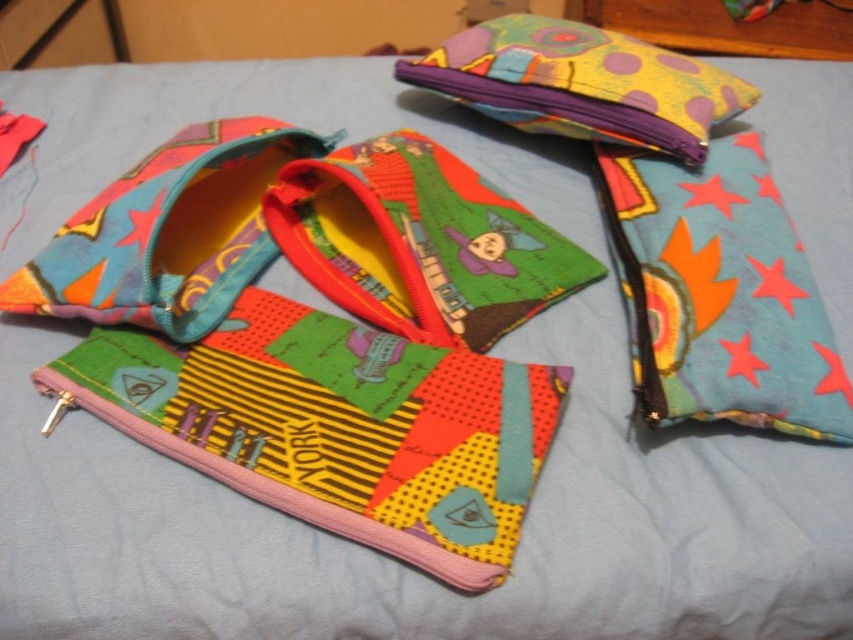
Is point (817, 348) positioned after point (502, 19)?

That is False.

Who is more distant from viewer, (670, 400) or (543, 44)?

The point (543, 44) is more distant.

Where is `teal fabric pouch at right`? The image size is (853, 640). teal fabric pouch at right is located at coordinates (718, 292).

I want to click on teal fabric pouch at right, so click(718, 292).